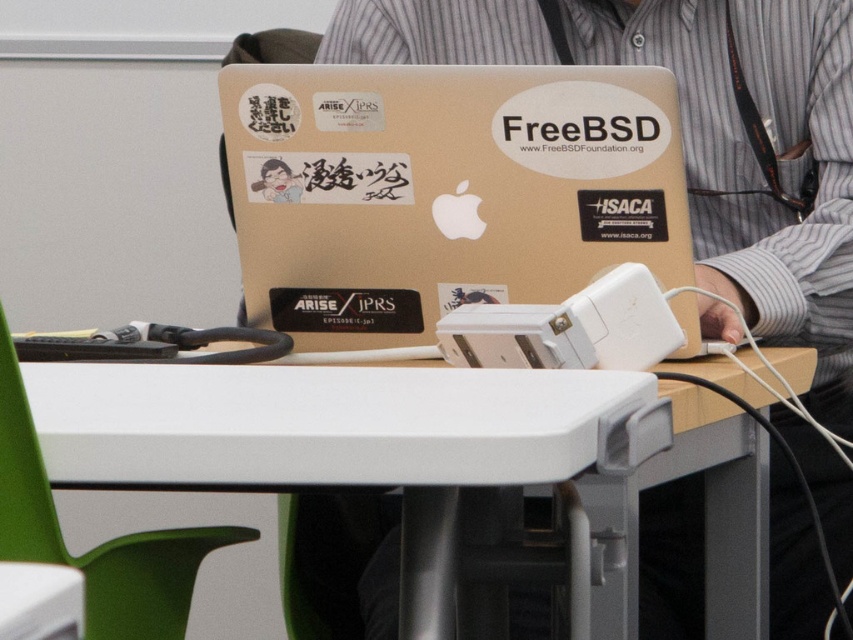
Can you confirm if metallic gold laptop at center is smaller than white plastic table at center?

Incorrect, metallic gold laptop at center is not smaller in size than white plastic table at center.

Is metallic gold laptop at center shorter than white plastic table at center?

In fact, metallic gold laptop at center may be taller than white plastic table at center.

Does point (675, 536) come farther from viewer compared to point (108, 410)?

Yes.

This screenshot has width=853, height=640. I want to click on metallic gold laptop at center, so click(698, 132).

Looking at this image, is glossy plastic laptop at center wider than white plastic table at center?

No, glossy plastic laptop at center is not wider than white plastic table at center.

Between point (300, 296) and point (193, 388), which one is positioned behind?

Positioned behind is point (300, 296).

Is point (433, 273) farther from viewer compared to point (444, 394)?

That is True.

The width and height of the screenshot is (853, 640). What are the coordinates of `glossy plastic laptop at center` in the screenshot? It's located at (444, 192).

Is glossy plastic laptop at center wider than metallic gold laptop at center?

No.

Looking at this image, does glossy plastic laptop at center appear on the right side of metallic gold laptop at center?

In fact, glossy plastic laptop at center is to the left of metallic gold laptop at center.

Is point (397, 196) positioned after point (793, 189)?

No, it is in front of (793, 189).

Where is `glossy plastic laptop at center`? The image size is (853, 640). glossy plastic laptop at center is located at coordinates (444, 192).